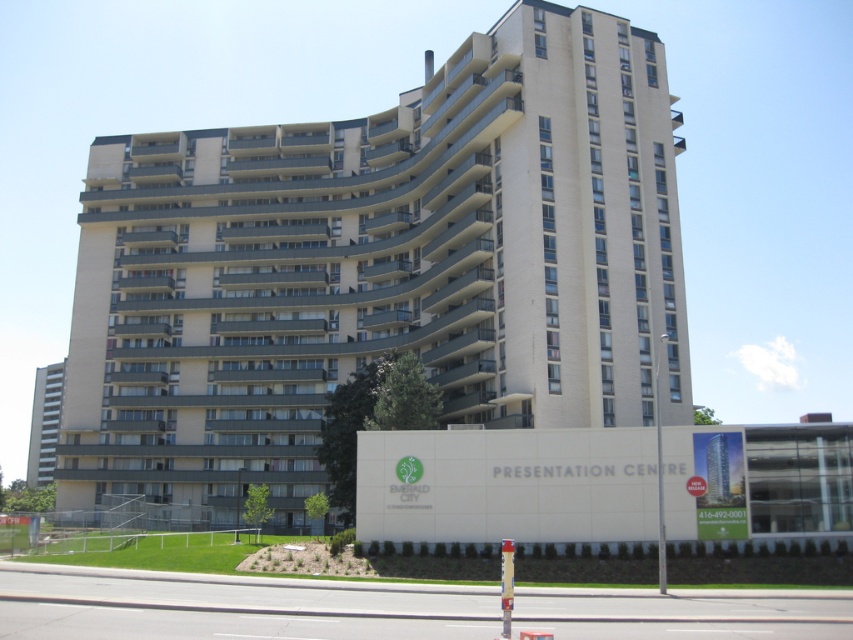
Can you confirm if beige concrete building at center is bigger than beige concrete building at left?

Indeed, beige concrete building at center has a larger size compared to beige concrete building at left.

You are a GUI agent. You are given a task and a screenshot of the screen. Output one action in this format:
    pyautogui.click(x=<x>, y=<y>)
    Task: Click on the beige concrete building at center
    The height and width of the screenshot is (640, 853).
    Given the screenshot: What is the action you would take?
    pyautogui.click(x=380, y=268)